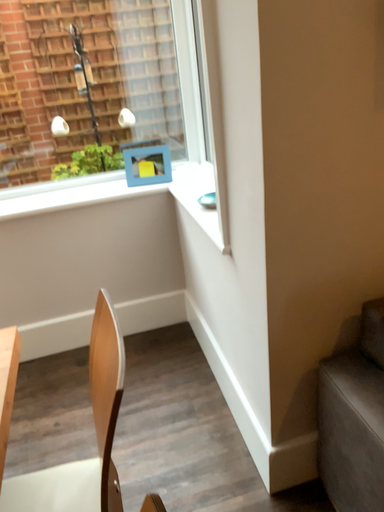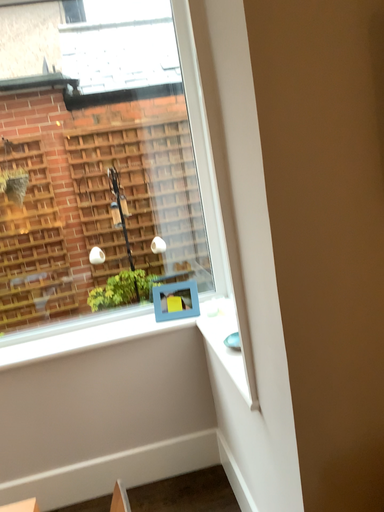
Question: Which way did the camera rotate in the video?

Choices:
 (A) rotated upward
 (B) rotated downward

Answer: (A)